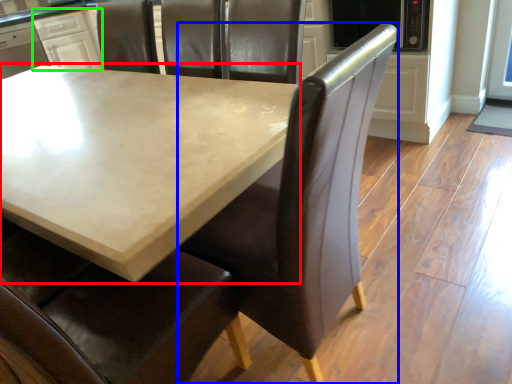
Question: Which object is positioned closest to table (highlighted by a red box)? Select from chair (highlighted by a blue box) and cabinetry (highlighted by a green box).

Choices:
 (A) chair
 (B) cabinetry

Answer: (A)